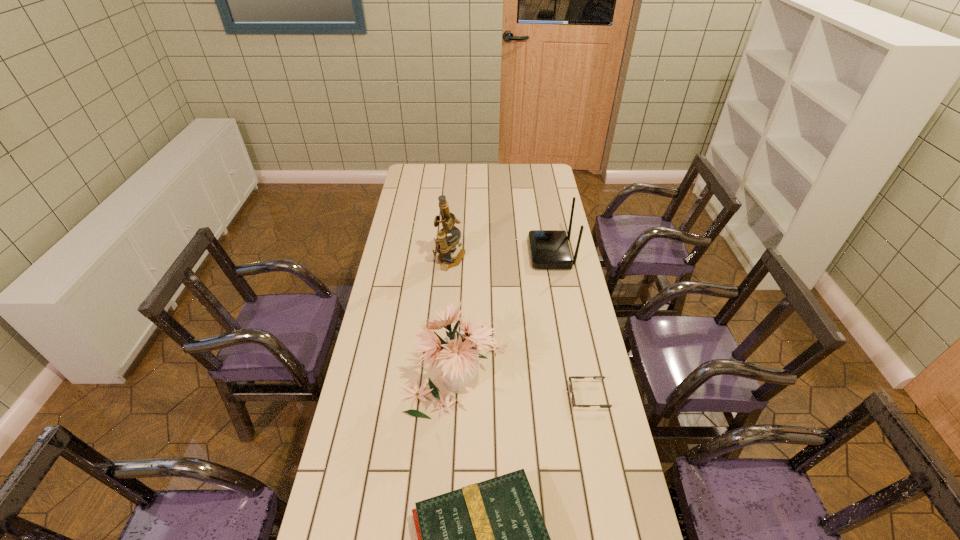
The height and width of the screenshot is (540, 960). Find the location of `free point between the shortest object and the third shortest object`. free point between the shortest object and the third shortest object is located at coordinates (569, 325).

I want to click on vacant space that's between the shortest object and the bouquet, so click(523, 382).

This screenshot has width=960, height=540. What are the coordinates of `vacant area that lies between the microscope and the shortest object` in the screenshot? It's located at (518, 328).

The height and width of the screenshot is (540, 960). I want to click on free spot between the bouquet and the router, so click(x=505, y=311).

What are the coordinates of `vacant region between the third tallest object and the microscope` in the screenshot? It's located at (500, 257).

Locate an element on the screen. free spot between the router and the sunglasses is located at coordinates (569, 325).

This screenshot has width=960, height=540. I want to click on free space that is in between the shortest object and the router, so click(x=569, y=325).

Identify the location of free space between the router and the bouquet. This screenshot has height=540, width=960. (505, 311).

Locate which object is the fourth closest to the sunglasses. Please provide its 2D coordinates. Your answer should be formatted as a tuple, i.e. [(x, y)], where the tuple contains the x and y coordinates of a point satisfying the conditions above.

[(445, 245)]

Identify which object is the second closest to the third shortest object. Please provide its 2D coordinates. Your answer should be formatted as a tuple, i.e. [(x, y)], where the tuple contains the x and y coordinates of a point satisfying the conditions above.

[(459, 352)]